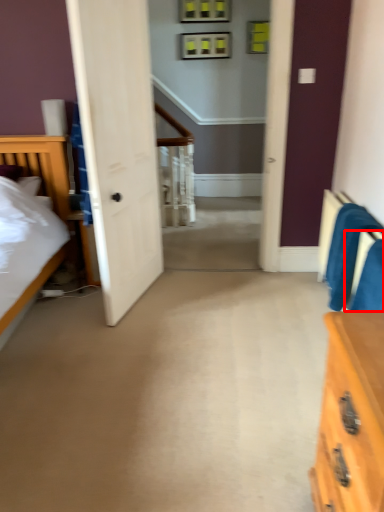
Question: Considering the relative positions of armchair (annotated by the red box) and armchair in the image provided, where is armchair (annotated by the red box) located with respect to the staircase?

Choices:
 (A) right
 (B) left

Answer: (B)